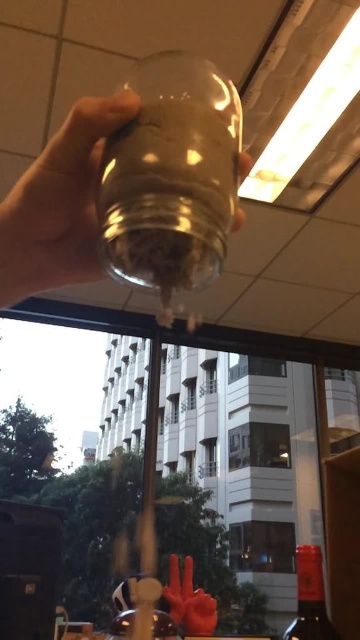
Question: Which point appears farthest from the camera in this image?

Choices:
 (A) (307, 563)
 (B) (65, 208)

Answer: (A)

Question: Which object is the closest to the transparent glass jar at upper left?

Choices:
 (A) translucent glass wine bottle at lower right
 (B) rubber glove at lower center

Answer: (A)

Question: Considering the relative positions of transparent glass jar at upper left and translucent glass wine bottle at lower right in the image provided, where is transparent glass jar at upper left located with respect to translucent glass wine bottle at lower right?

Choices:
 (A) above
 (B) below

Answer: (A)

Question: Does translucent glass wine bottle at lower right have a larger size compared to rubber glove at lower center?

Choices:
 (A) yes
 (B) no

Answer: (B)

Question: Can you confirm if translucent glass wine bottle at lower right is smaller than rubber glove at lower center?

Choices:
 (A) yes
 (B) no

Answer: (A)

Question: Which object is positioned closest to the rubber glove at lower center?

Choices:
 (A) transparent glass jar at upper left
 (B) translucent glass wine bottle at lower right

Answer: (B)